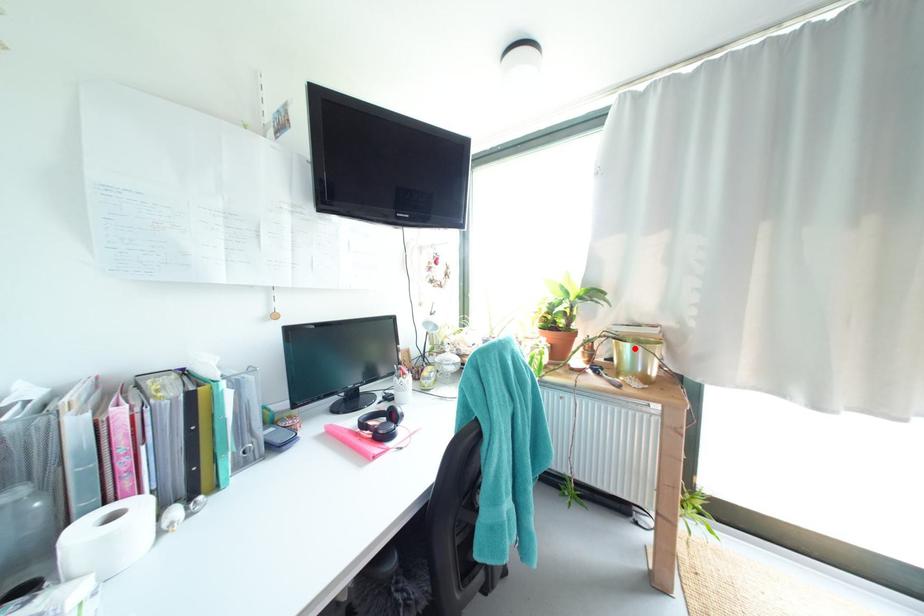
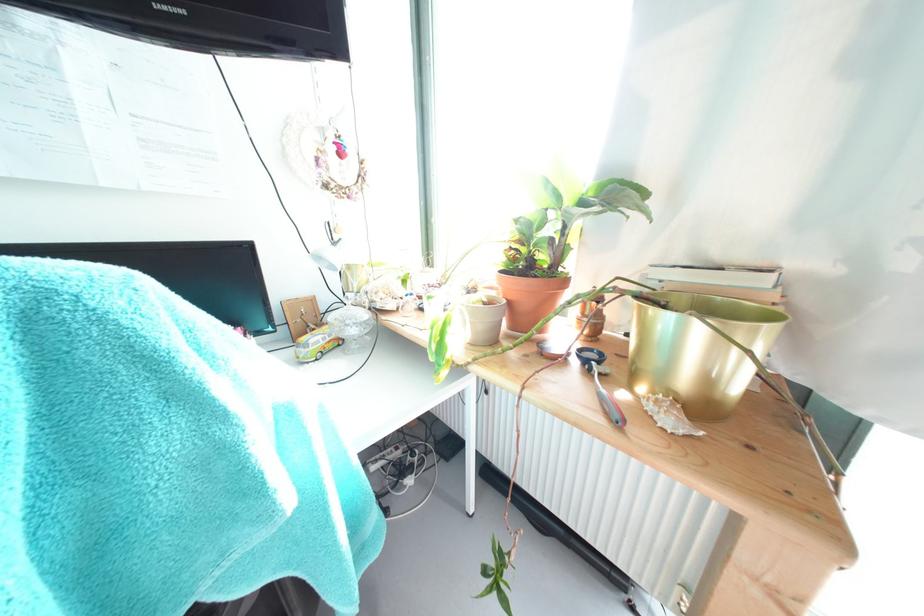
Question: A red point is marked in image1. In image2, is the corresponding 3D point closer to the camera or farther? Reply with the corresponding letter.

Choices:
 (A) The corresponding 3D point is closer.
 (B) The corresponding 3D point is farther.

Answer: (A)